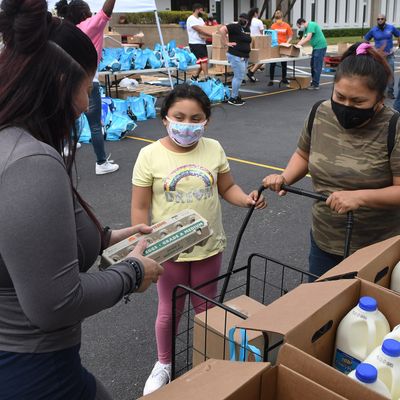
Where is `table`? This screenshot has width=400, height=400. table is located at coordinates (150, 70), (273, 60).